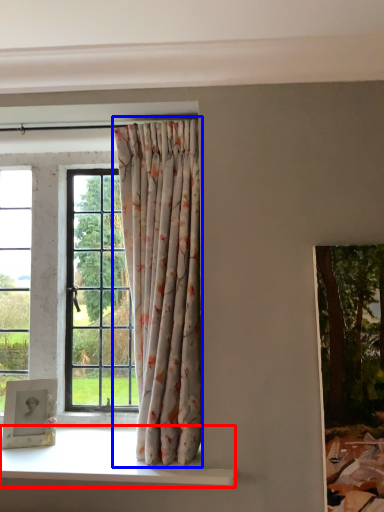
Question: Which point is further to the camera, window sill (highlighted by a red box) or curtain (highlighted by a blue box)?

Choices:
 (A) window sill
 (B) curtain

Answer: (B)